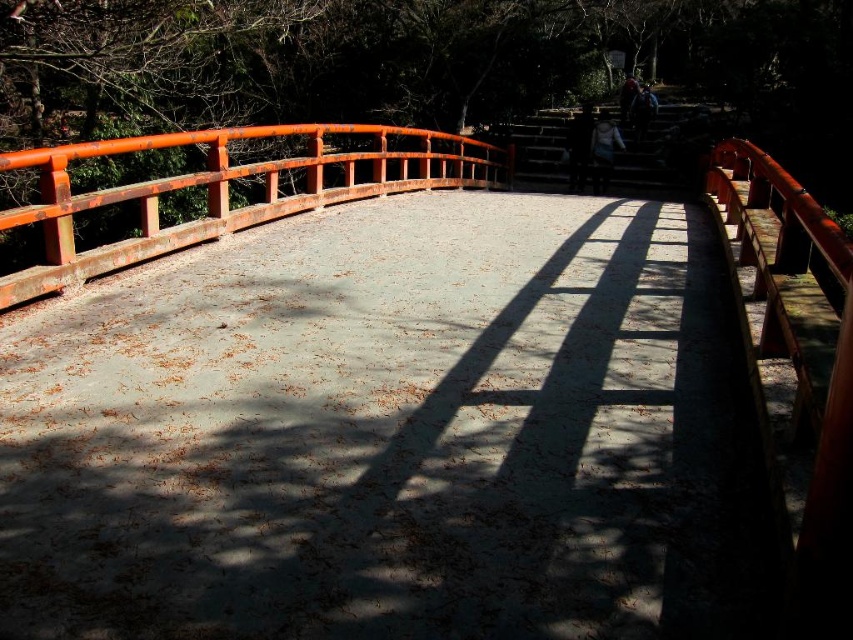
Question: Which point is farther to the camera?

Choices:
 (A) (473, 179)
 (B) (651, 116)
 (C) (584, 152)

Answer: (B)

Question: Is light brown leather jacket at center further to the viewer compared to dark gray fabric jacket at upper center?

Choices:
 (A) no
 (B) yes

Answer: (A)

Question: Which object is the closest to the rustic wood bridge at center?

Choices:
 (A) dark gray fabric jacket at upper center
 (B) smooth concrete path at center
 (C) dark brown leather jacket at upper center

Answer: (A)

Question: Which object appears farthest from the camera in this image?

Choices:
 (A) smooth concrete path at center
 (B) blue denim jacket at upper center
 (C) light brown leather jacket at center

Answer: (B)

Question: Considering the relative positions of dark gray fabric jacket at upper center and dark brown leather jacket at upper center in the image provided, where is dark gray fabric jacket at upper center located with respect to dark brown leather jacket at upper center?

Choices:
 (A) left
 (B) right

Answer: (A)

Question: Does dark gray fabric jacket at upper center appear on the right side of dark brown leather jacket at upper center?

Choices:
 (A) no
 (B) yes

Answer: (A)